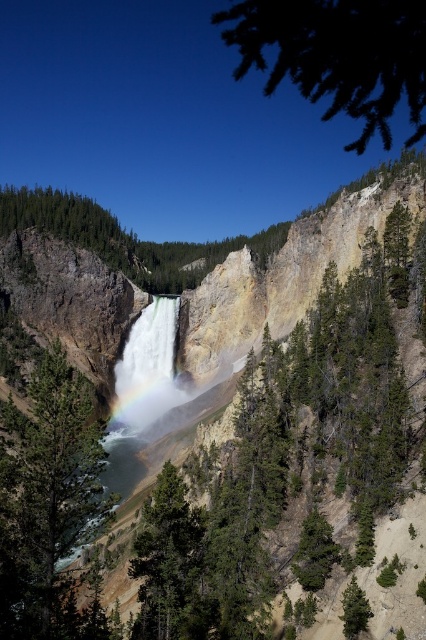
Question: Which of these objects is positioned closest to the green matte tree at center?

Choices:
 (A) green leafy branch at upper right
 (B) green matte tree at lower right
 (C) green rough bark tree at lower center
 (D) rainbow-colored water at center

Answer: (C)

Question: Can you confirm if green rough bark tree at lower center is positioned below green matte tree at lower right?

Choices:
 (A) no
 (B) yes

Answer: (A)

Question: Is green leafy branch at upper right to the right of green matte tree at lower right from the viewer's perspective?

Choices:
 (A) yes
 (B) no

Answer: (A)

Question: Considering the real-world distances, which object is closest to the green rough bark tree at lower center?

Choices:
 (A) green leafy branch at upper right
 (B) green matte tree at lower right
 (C) green matte tree at center
 (D) rainbow-colored water at center

Answer: (C)

Question: Can you confirm if green rough bark tree at lower center is positioned below rainbow-colored water at center?

Choices:
 (A) no
 (B) yes

Answer: (B)

Question: Based on their relative distances, which object is nearer to the green leafy branch at upper right?

Choices:
 (A) green matte tree at center
 (B) green rough bark tree at lower center
 (C) rainbow-colored water at center

Answer: (B)